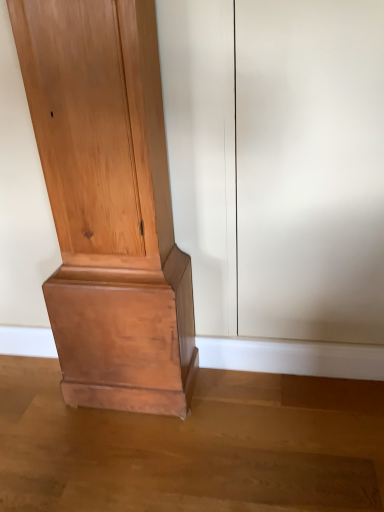
Identify the location of vacant region to the left of matte wood cabinet at left. (38, 407).